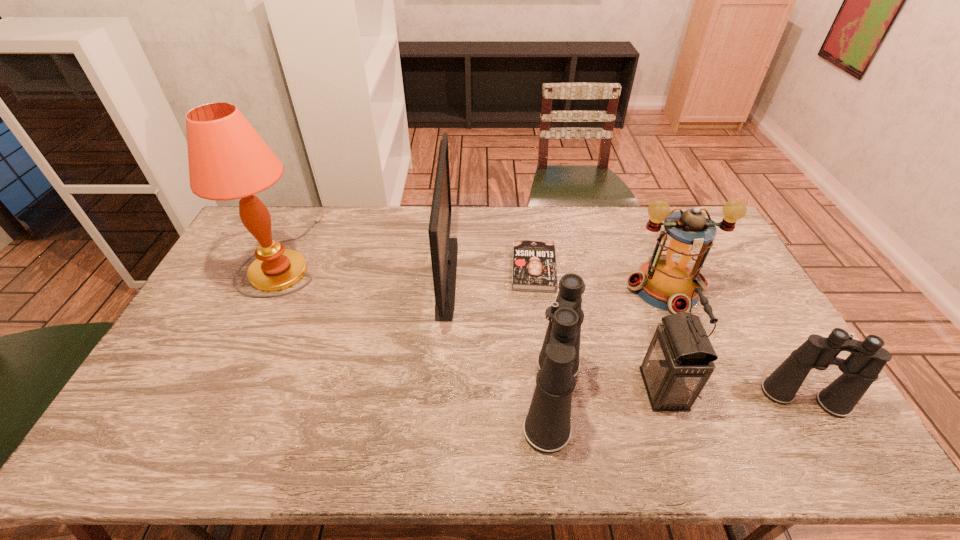
Locate an element on the screen. The image size is (960, 540). the taller binoculars is located at coordinates (547, 428).

You are a GUI agent. You are given a task and a screenshot of the screen. Output one action in this format:
    pyautogui.click(x=<x>, y=<y>)
    Task: Click on the sixth tallest object
    
    Given the screenshot: What is the action you would take?
    pyautogui.click(x=861, y=368)

You are a GUI agent. You are given a task and a screenshot of the screen. Output one action in this format:
    pyautogui.click(x=<x>, y=<y>)
    Task: Click on the rightmost object
    This screenshot has height=540, width=960.
    Given the screenshot: What is the action you would take?
    pyautogui.click(x=861, y=368)

Where is `monitor`? The height and width of the screenshot is (540, 960). monitor is located at coordinates tap(444, 250).

The image size is (960, 540). What are the coordinates of `the farther lantern` in the screenshot? It's located at (667, 281).

Where is `the leftmost object`? The width and height of the screenshot is (960, 540). the leftmost object is located at coordinates (228, 160).

This screenshot has width=960, height=540. Identify the location of the tallest object. (228, 160).

What are the coordinates of `the shortest object` in the screenshot? It's located at (534, 264).

Locate an element on the screen. The image size is (960, 540). the nearer lantern is located at coordinates (679, 361).

At what (x,y) coordinates should I click in order to perform the action: click on vacant position located 0.270m on the back of the left binoculars. Please return your answer as a coordinate pair (x, y). The height and width of the screenshot is (540, 960). Looking at the image, I should click on (538, 283).